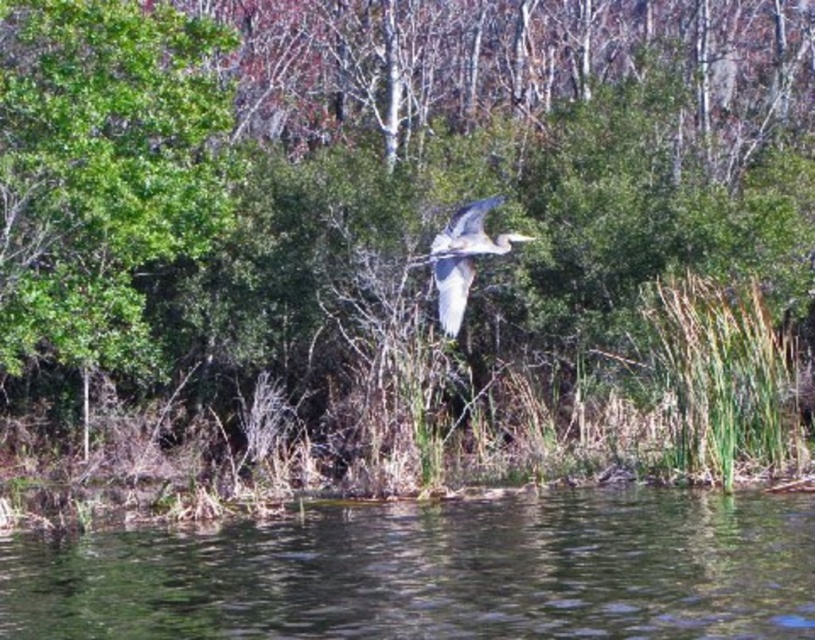
Question: Which point is closer to the camera?

Choices:
 (A) green leafy tree at upper center
 (B) clear water at lower center

Answer: (B)

Question: Which object is positioned closest to the clear water at lower center?

Choices:
 (A) green leafy tree at upper center
 (B) gray feathered heron at center

Answer: (B)

Question: Is clear water at lower center positioned at the back of gray feathered heron at center?

Choices:
 (A) no
 (B) yes

Answer: (A)

Question: Does green leafy tree at upper center have a greater width compared to clear water at lower center?

Choices:
 (A) yes
 (B) no

Answer: (A)

Question: Can you confirm if green leafy tree at upper center is smaller than gray feathered heron at center?

Choices:
 (A) yes
 (B) no

Answer: (B)

Question: Which is farther from the gray feathered heron at center?

Choices:
 (A) green leafy tree at upper center
 (B) clear water at lower center

Answer: (A)